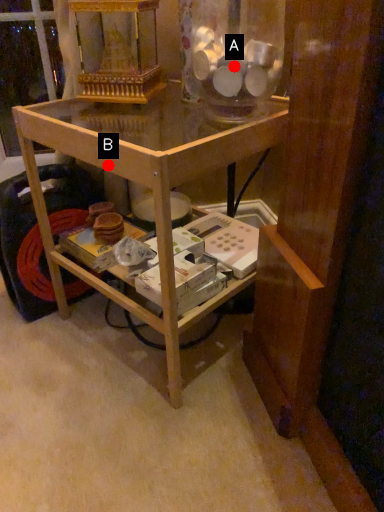
Question: Two points are circled on the image, labeled by A and B beside each circle. Which point is further to the camera?

Choices:
 (A) A is further
 (B) B is further

Answer: (A)